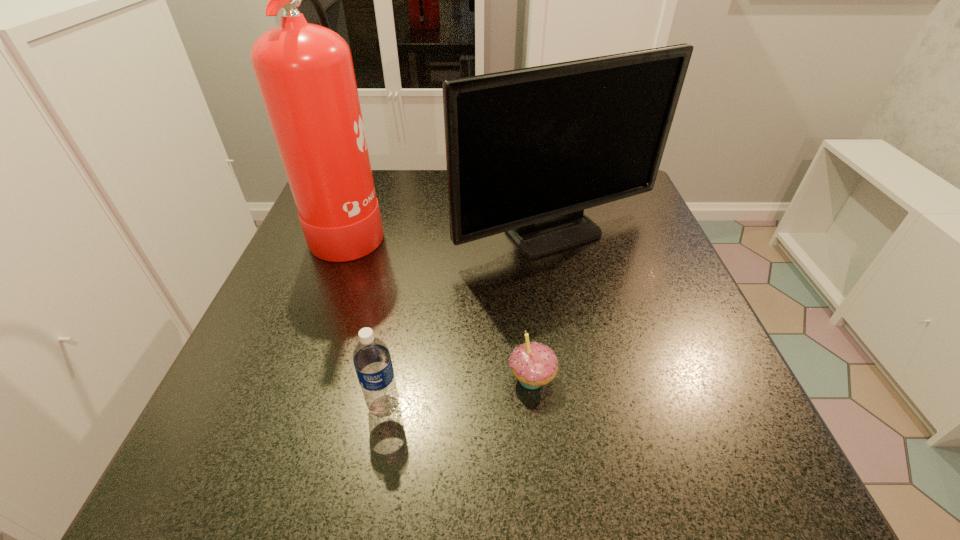
The width and height of the screenshot is (960, 540). What are the coordinates of `free area in between the water bottle and the leftmost object` in the screenshot? It's located at (368, 316).

Image resolution: width=960 pixels, height=540 pixels. Find the location of `vacant space that is in between the second shortest object and the fire extinguisher`. vacant space that is in between the second shortest object and the fire extinguisher is located at coordinates (368, 316).

Select which object appears as the second closest to the third shortest object. Please provide its 2D coordinates. Your answer should be formatted as a tuple, i.e. [(x, y)], where the tuple contains the x and y coordinates of a point satisfying the conditions above.

[(533, 364)]

The image size is (960, 540). What are the coordinates of `object that stands as the second closest to the computer monitor` in the screenshot? It's located at (533, 364).

At what (x,y) coordinates should I click in order to perform the action: click on free point that satisfies the following two spatial constraints: 1. towards the nozzle of the leftmost object; 2. on the left side of the shortest object. Please return your answer as a coordinate pair (x, y). Looking at the image, I should click on (295, 379).

Where is `vacant space that satisfies the following two spatial constraints: 1. towards the nozzle of the fire extinguisher; 2. on the right side of the cupcake`? vacant space that satisfies the following two spatial constraints: 1. towards the nozzle of the fire extinguisher; 2. on the right side of the cupcake is located at coordinates (295, 379).

Find the location of a particular element. blank area in the image that satisfies the following two spatial constraints: 1. towards the nozzle of the fire extinguisher; 2. on the left side of the water bottle is located at coordinates (285, 406).

Where is `free space that satisfies the following two spatial constraints: 1. towards the nozzle of the leftmost object; 2. on the back side of the cupcake`? Image resolution: width=960 pixels, height=540 pixels. free space that satisfies the following two spatial constraints: 1. towards the nozzle of the leftmost object; 2. on the back side of the cupcake is located at coordinates (295, 379).

Locate an element on the screen. This screenshot has width=960, height=540. free space that satisfies the following two spatial constraints: 1. on the back side of the third object from right to left; 2. on the right side of the cupcake is located at coordinates (389, 379).